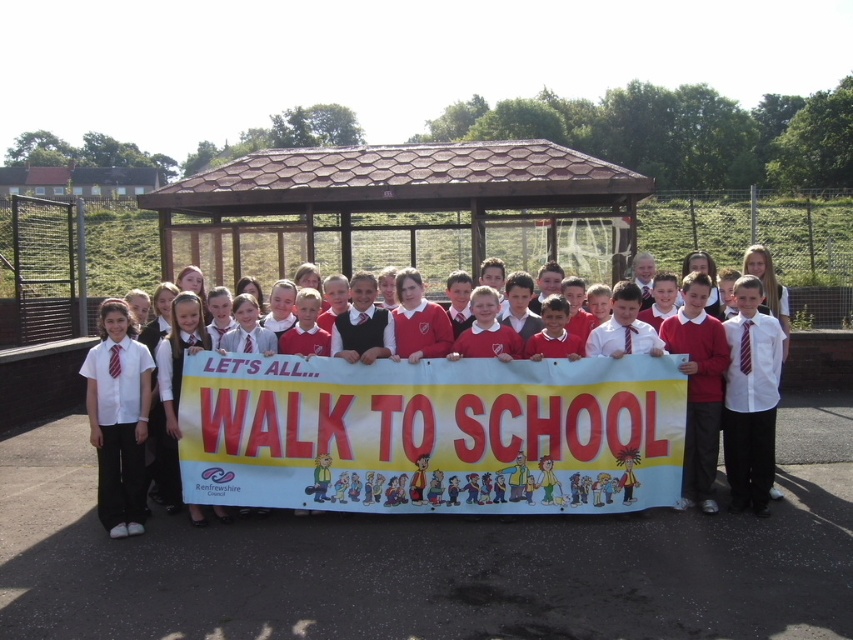
Based on the coordinates provided in the scene, which object is located at point (119, 426)?

The point (119, 426) corresponds to the white shirt at left.

You are a photographer taking a picture of the children holding the banner. To ensure both the white shirt at left and the white shirt with tie at right are clearly visible in the photo, which child should you focus on first?

You should focus on the white shirt with tie at right first because the white shirt at left is positioned under it, meaning the one at right is closer to the camera and needs to be in focus first to ensure both are visible.